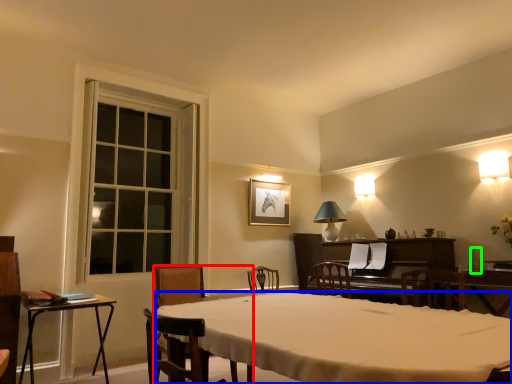
Question: Based on their relative distances, which object is farther from chair (highlighted by a red box)? Choose from desk (highlighted by a blue box) and bottle (highlighted by a green box).

Choices:
 (A) desk
 (B) bottle

Answer: (B)